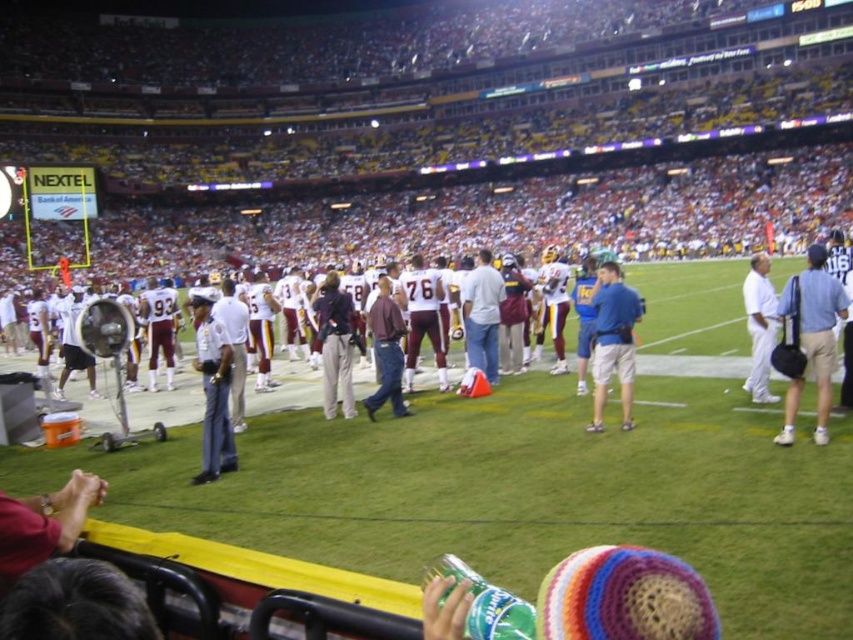
Question: Which of the following is the closest to the observer?

Choices:
 (A) (93, 333)
 (B) (604, 273)
 (C) (213, 365)

Answer: (C)

Question: Is maroon fabric shirt at center closer to the viewer compared to white cotton shirt at right?

Choices:
 (A) yes
 (B) no

Answer: (B)

Question: Is light blue shirt at right above metallic silver fan at center?

Choices:
 (A) no
 (B) yes

Answer: (B)

Question: Which point is closer to the camera?

Choices:
 (A) (601, 291)
 (B) (392, 323)
 (C) (815, 298)

Answer: (C)

Question: Can you confirm if light blue shirt at right is positioned to the left of blue fabric shirt at center?

Choices:
 (A) no
 (B) yes

Answer: (A)

Question: Based on their relative distances, which object is farther from the maroon fabric shirt at center?

Choices:
 (A) white cotton shirt at right
 (B) metallic silver fan at center
 (C) white uniform at center
 (D) blue fabric shirt at center

Answer: (A)